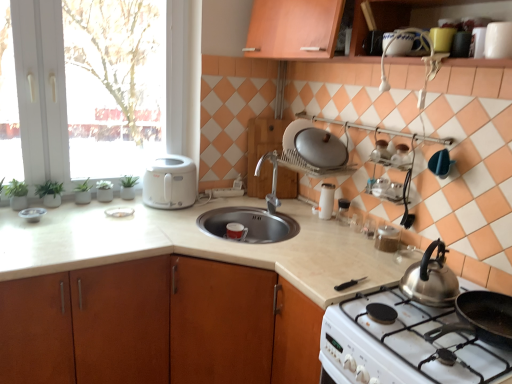
The image size is (512, 384). What are the coordinates of `free location above white glossy countertop at center (from a real-world perspective)` in the screenshot? It's located at (177, 230).